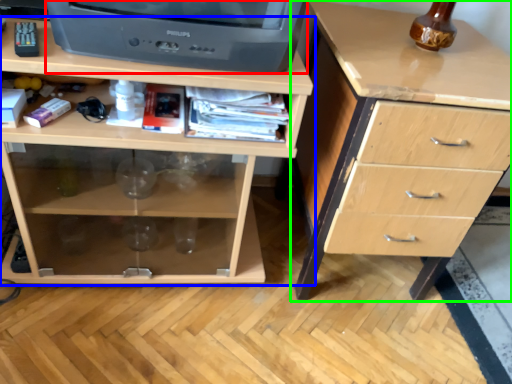
Question: Which is nearer to the television (highlighted by a red box)? chest of drawers (highlighted by a blue box) or chest of drawers (highlighted by a green box).

Choices:
 (A) chest of drawers
 (B) chest of drawers

Answer: (A)